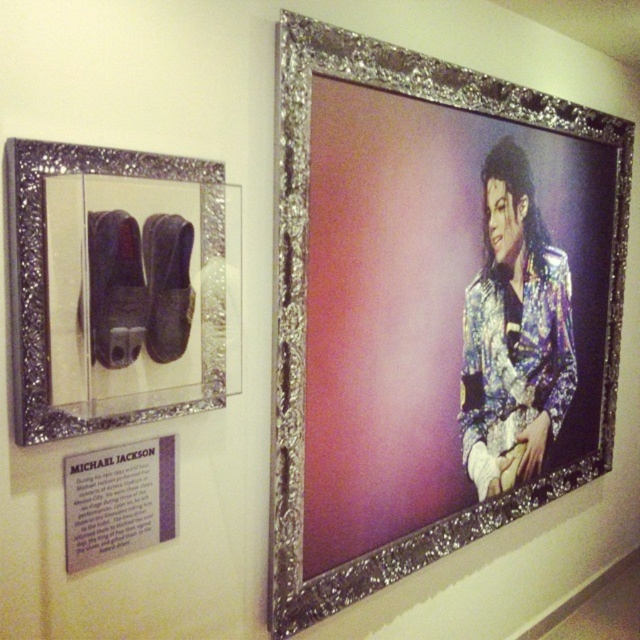
Question: Among these points, which one is nearest to the camera?

Choices:
 (A) (488, 456)
 (B) (44, 381)
 (C) (156, 314)
 (D) (337, 580)

Answer: (B)

Question: Is suede-like leather shoe at left smaller than shiny leather shoe at upper left?

Choices:
 (A) no
 (B) yes

Answer: (A)

Question: Considering the real-world distances, which object is closest to the silver glittery picture frame at upper right?

Choices:
 (A) shiny metallic jacket at center-right
 (B) matte silver plaque at lower left
 (C) suede-like leather shoe at left
 (D) shiny leather shoe at upper left

Answer: (A)

Question: Is silver glitter shoes at left smaller than shiny leather shoe at upper left?

Choices:
 (A) yes
 (B) no

Answer: (B)

Question: Can you confirm if silver glittery picture frame at upper right is smaller than matte silver plaque at lower left?

Choices:
 (A) yes
 (B) no

Answer: (B)

Question: Which point is farther from the camera taking this photo?

Choices:
 (A) (100, 289)
 (B) (172, 282)
 (C) (506, 259)

Answer: (C)